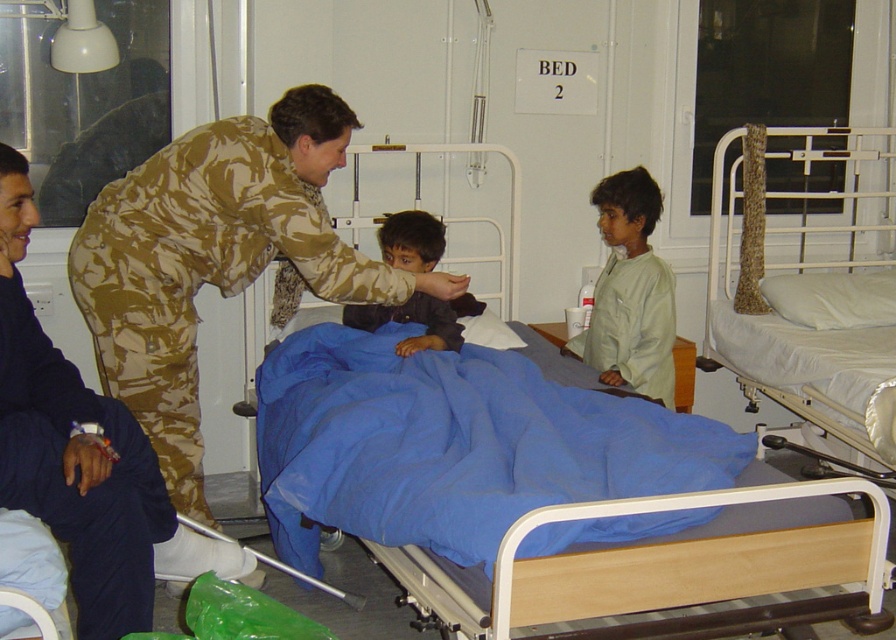
You are a nurse in this hospital room. You need to adjust the height of the blue fabric hospital bed at center and the white fabric bed at right so that both beds are at the same height. Which bed should you raise and which should you lower?

The blue fabric hospital bed at center is not as tall as the white fabric bed at right. Therefore, you should raise the blue fabric hospital bed at center and lower the white fabric bed at right to make them the same height.

You are a nurse in this hospital room. You need to place a medical kit on the surface of the blue fabric hospital bed at center. However, there is a light beige fabric shirt at center already on the bed. Can the medical kit fit on the bed along with the shirt?

The blue fabric hospital bed at center is bigger than the light beige fabric shirt at center. Therefore, the medical kit can fit on the bed along with the shirt since the bed has enough space.